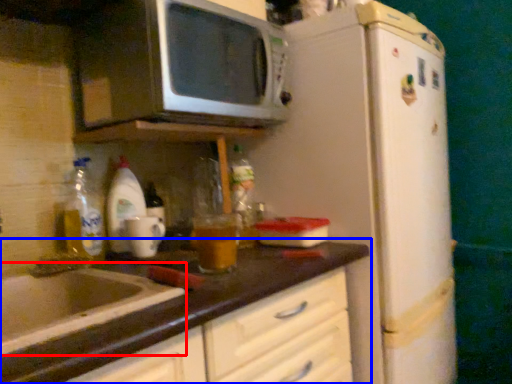
Question: Which object appears farthest to the camera in this image, sink (highlighted by a red box) or countertop (highlighted by a blue box)?

Choices:
 (A) sink
 (B) countertop

Answer: (A)